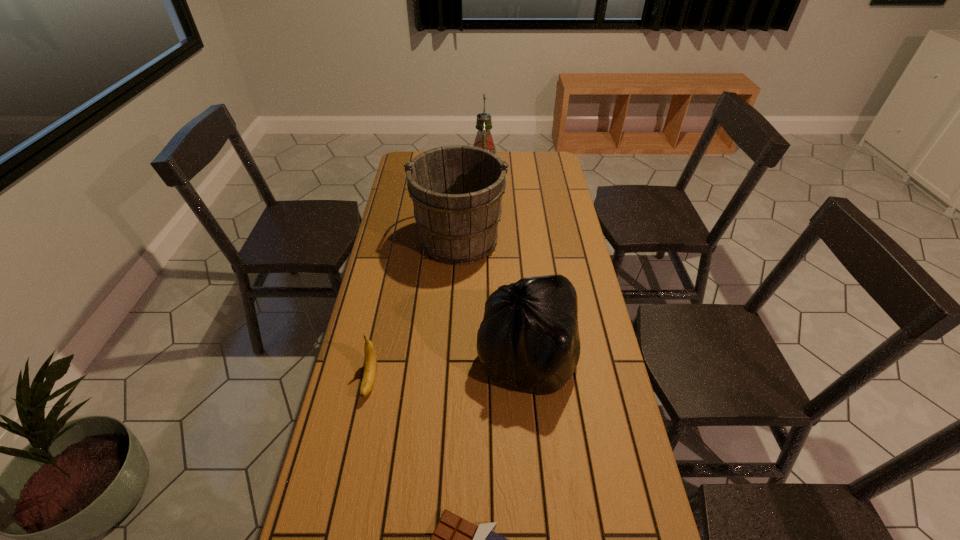
Identify the location of vacant space located at the start of the peel on the banana. The width and height of the screenshot is (960, 540). (343, 516).

Find the location of a particular element. This screenshot has height=540, width=960. object that is at the far edge is located at coordinates (484, 140).

Where is `bucket at the left edge`? Image resolution: width=960 pixels, height=540 pixels. bucket at the left edge is located at coordinates (456, 190).

Find the location of a particular element. This screenshot has width=960, height=540. banana that is at the left edge is located at coordinates (370, 367).

The height and width of the screenshot is (540, 960). I want to click on object present at the right edge, so (529, 338).

Find the location of a particular element. The width and height of the screenshot is (960, 540). vacant space at the left edge of the desktop is located at coordinates (386, 379).

Where is `vacant space at the right edge of the desktop`? This screenshot has width=960, height=540. vacant space at the right edge of the desktop is located at coordinates (608, 442).

Find the location of a particular element. blank space at the far left corner of the desktop is located at coordinates (401, 157).

The width and height of the screenshot is (960, 540). Find the location of `free space at the far right corner of the desktop`. free space at the far right corner of the desktop is located at coordinates (544, 157).

I want to click on unoccupied position between the plastic bag and the second shortest object, so click(448, 368).